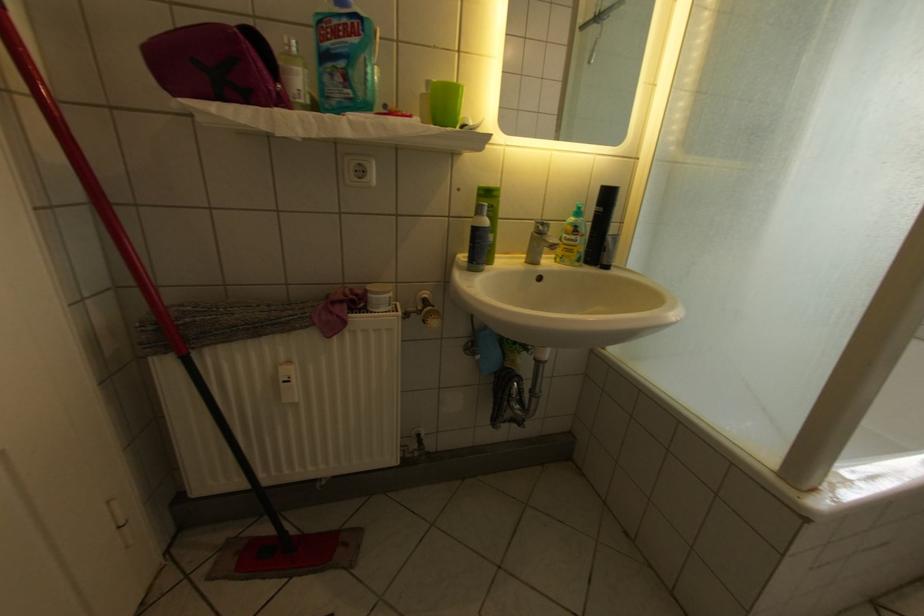
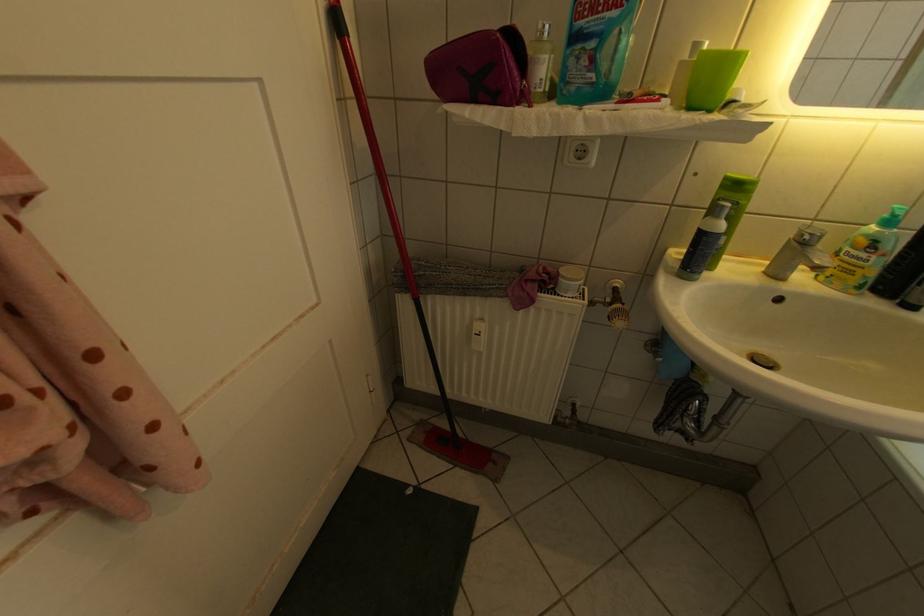
Question: The first image is from the beginning of the video and the second image is from the end. How did the camera likely rotate when shooting the video?

Choices:
 (A) Left
 (B) Right
 (C) Up
 (D) Down

Answer: (A)